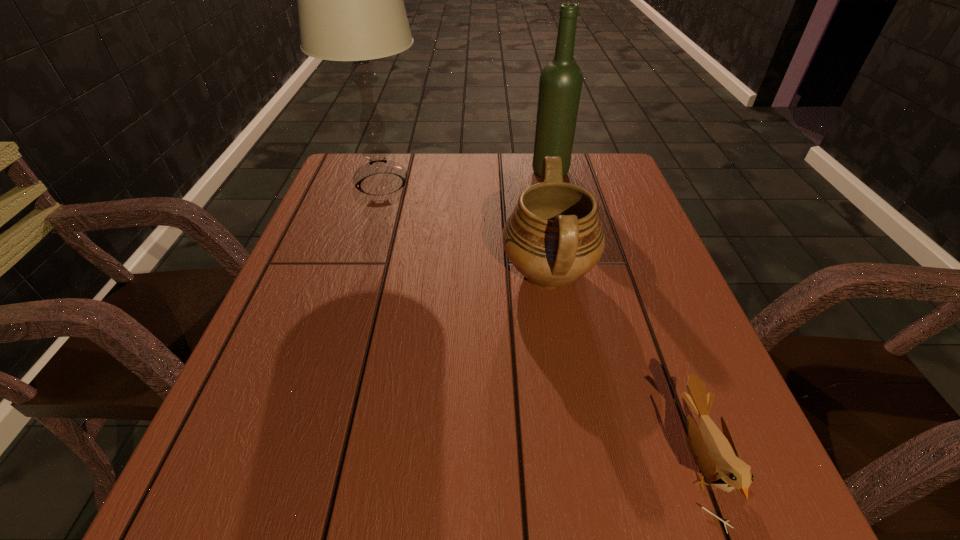
This screenshot has width=960, height=540. Find the location of `urn that is at the right edge`. urn that is at the right edge is located at coordinates (553, 237).

At what (x,y) coordinates should I click in order to perform the action: click on bird situated at the right edge. Please return your answer as a coordinate pair (x, y). This screenshot has height=540, width=960. Looking at the image, I should click on (715, 454).

Identify the location of object at the far left corner. (350, 3).

The image size is (960, 540). Find the location of `object at the far right corner`. object at the far right corner is located at coordinates (560, 84).

The width and height of the screenshot is (960, 540). I want to click on object located in the near right corner section of the desktop, so click(715, 454).

Where is `vacant space at the far edge`? The image size is (960, 540). vacant space at the far edge is located at coordinates (434, 187).

The image size is (960, 540). I want to click on free space at the near edge, so click(x=516, y=477).

The image size is (960, 540). In order to click on vacant space at the left edge of the desktop in this screenshot , I will do pos(356,228).

Locate an element on the screen. This screenshot has width=960, height=540. free spot at the right edge of the desktop is located at coordinates (626, 263).

This screenshot has width=960, height=540. I want to click on vacant space at the far left corner, so click(x=365, y=195).